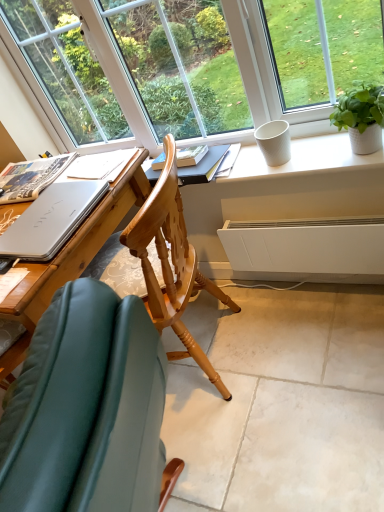
Question: Is the position of sleek silver laptop at left less distant than that of white paper at left?

Choices:
 (A) yes
 (B) no

Answer: (A)

Question: From a real-world perspective, is sleek silver laptop at left located beneath white paper at left?

Choices:
 (A) yes
 (B) no

Answer: (B)

Question: Considering the relative positions of sleek silver laptop at left and white paper at left in the image provided, is sleek silver laptop at left to the right of white paper at left from the viewer's perspective?

Choices:
 (A) no
 (B) yes

Answer: (B)

Question: From a real-world perspective, is sleek silver laptop at left positioned over white paper at left based on gravity?

Choices:
 (A) yes
 (B) no

Answer: (A)

Question: Is sleek silver laptop at left positioned with its back to white paper at left?

Choices:
 (A) yes
 (B) no

Answer: (B)

Question: Could you tell me if sleek silver laptop at left is facing white paper at left?

Choices:
 (A) no
 (B) yes

Answer: (A)

Question: From a real-world perspective, is white paper at left positioned over sleek silver laptop at left based on gravity?

Choices:
 (A) no
 (B) yes

Answer: (A)

Question: Would you consider white paper at left to be distant from sleek silver laptop at left?

Choices:
 (A) yes
 (B) no

Answer: (B)

Question: Is the depth of white paper at left greater than that of sleek silver laptop at left?

Choices:
 (A) no
 (B) yes

Answer: (B)

Question: Is white paper at left with sleek silver laptop at left?

Choices:
 (A) yes
 (B) no

Answer: (B)

Question: Considering the relative sizes of white paper at left and sleek silver laptop at left in the image provided, is white paper at left thinner than sleek silver laptop at left?

Choices:
 (A) yes
 (B) no

Answer: (A)

Question: Is white paper at left looking in the opposite direction of sleek silver laptop at left?

Choices:
 (A) no
 (B) yes

Answer: (A)

Question: Could you tell me if sleek silver laptop at left is turned towards wooden chair at center?

Choices:
 (A) yes
 (B) no

Answer: (A)